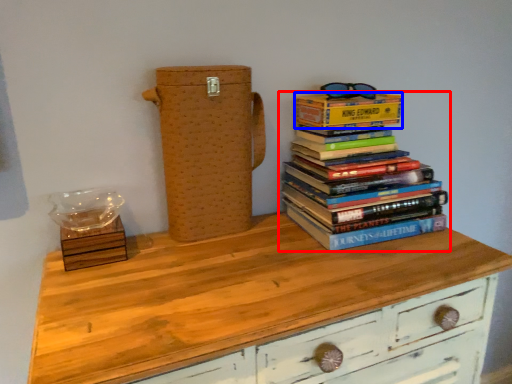
Question: Among these objects, which one is farthest to the camera, book (highlighted by a red box) or paperback book (highlighted by a blue box)?

Choices:
 (A) book
 (B) paperback book

Answer: (B)